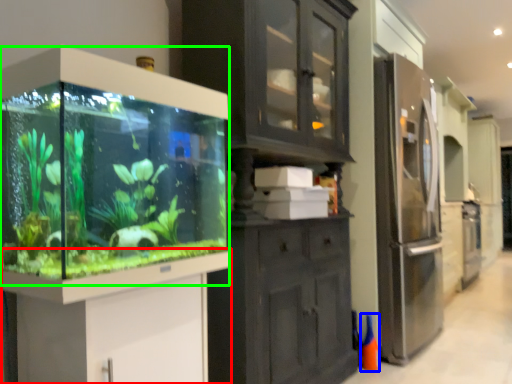
Question: Which object is the closest to the vanity (highlighted by a red box)? Choose among these: cone (highlighted by a blue box) or glass box (highlighted by a green box).

Choices:
 (A) cone
 (B) glass box

Answer: (B)